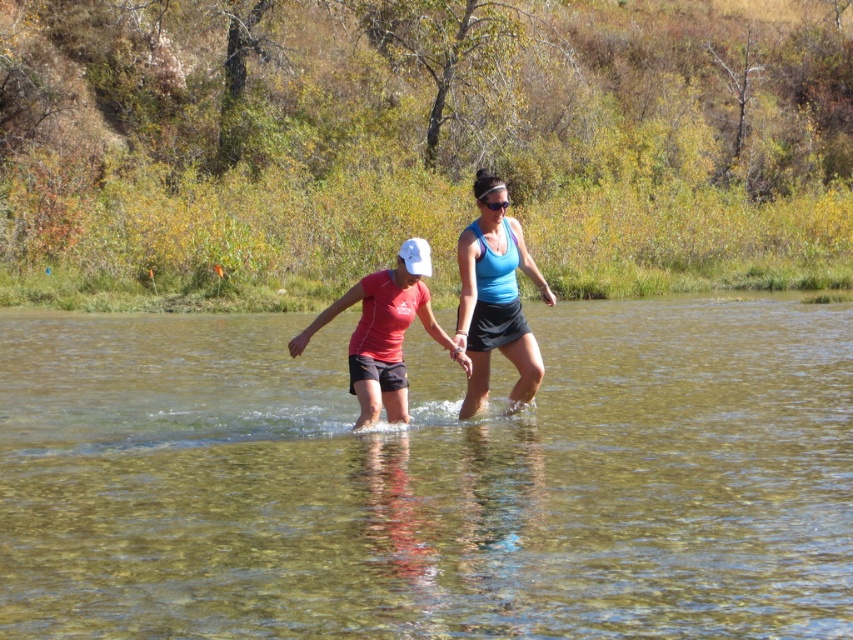
You are standing on the bank of the river and see the clear water at center and the matte red shirt at center. Which object is located to the left of the other?

The clear water at center is positioned on the left side of matte red shirt at center.

In the scene shown: You are standing on the riverbank and see two people in the water. The person wearing the matte red shirt at center and the one in the blue matte tank top at center are facing away from you. Which one is closer to the left bank?

The matte red shirt at center is to the left of the blue matte tank top at center, so the person in the matte red shirt at center is closer to the left bank.